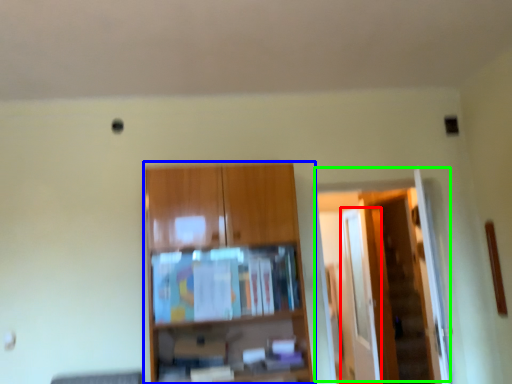
Question: Which object is the farthest from glass door (highlighted by a red box)? Choose among these: cupboard (highlighted by a blue box) or door (highlighted by a green box).

Choices:
 (A) cupboard
 (B) door

Answer: (A)